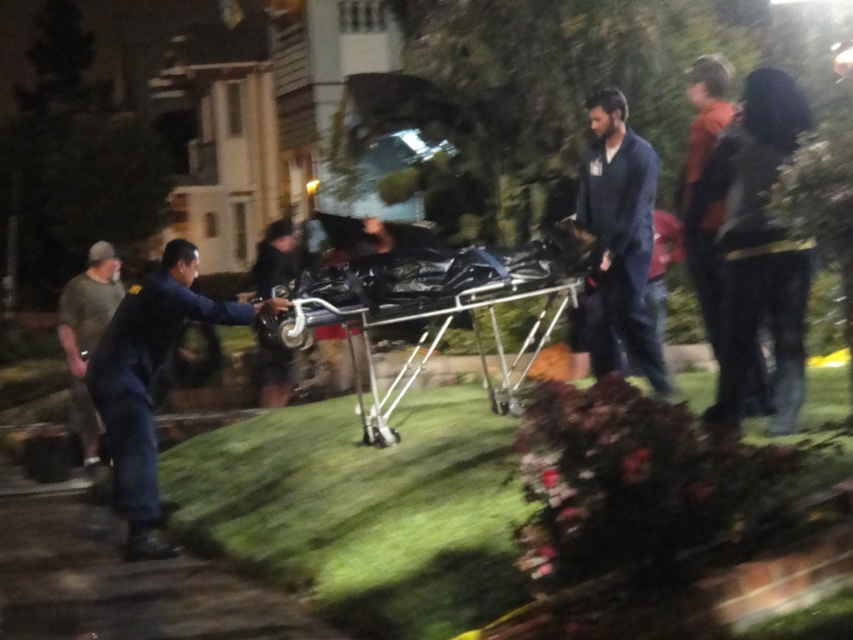
Question: Which object is positioned closest to the metallic silver cart at center?

Choices:
 (A) green cotton t-shirt at left
 (B) blue fabric shirt at center

Answer: (B)

Question: Is blue fabric shirt at center to the right of green cotton t-shirt at left from the viewer's perspective?

Choices:
 (A) yes
 (B) no

Answer: (A)

Question: Is dark blue uniform at left behind green cotton t-shirt at left?

Choices:
 (A) no
 (B) yes

Answer: (A)

Question: Which object appears farthest from the camera in this image?

Choices:
 (A) metallic silver cart at center
 (B) dark blue uniform at left

Answer: (A)

Question: Which object appears closest to the camera in this image?

Choices:
 (A) dark blue uniform at left
 (B) metallic silver cart at center
 (C) blue fabric shirt at center
 (D) green cotton t-shirt at left

Answer: (A)

Question: Is dark blue uniform at left wider than metallic silver cart at center?

Choices:
 (A) no
 (B) yes

Answer: (A)